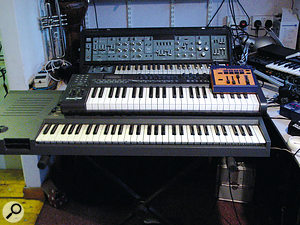
This screenshot has height=225, width=300. I want to click on piano, so click(x=282, y=64).